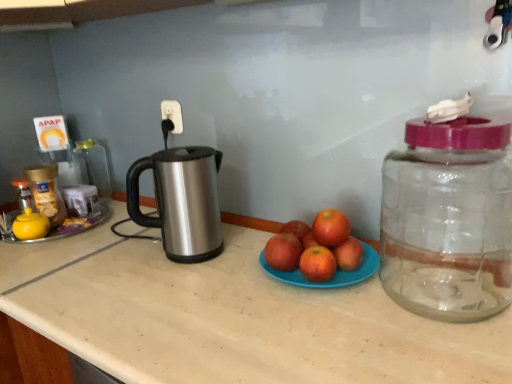
Question: Is transparent plastic jar at right, which is the third bottle in left-to-right order, spatially inside beige laminate countertop at center, or outside of it?

Choices:
 (A) outside
 (B) inside

Answer: (A)

Question: From the image's perspective, is transparent plastic jar at right, the first bottle positioned from the right, above or below beige laminate countertop at center?

Choices:
 (A) below
 (B) above

Answer: (B)

Question: Estimate the real-world distances between objects in this image. Which object is farther from the red matte apple at center, which is the 2th apple from right to left?

Choices:
 (A) orange matte grapefruit at center, which is counted as the 2th grapefruit, starting from the bottom
 (B) gold plastic jar at left, acting as the 2th bottle starting from the front
 (C) beige laminate countertop at center
 (D) orange matte grapefruit at center, which ranks as the 1th grapefruit in bottom-to-top order
 (E) transparent plastic jar at right, the first bottle positioned from the right

Answer: (B)

Question: Which is nearer to the satin silver kettle at left?

Choices:
 (A) transparent plastic jar at right, which is the 3th bottle in back-to-front order
 (B) orange matte grapefruit at center, which ranks as the 1th grapefruit in bottom-to-top order
 (C) orange matte grapefruit at center, the 1th grapefruit viewed from the top
 (D) red matte apple at center, acting as the first apple starting from the right
 (E) red matte apple at center, which is the 2th apple from right to left

Answer: (E)